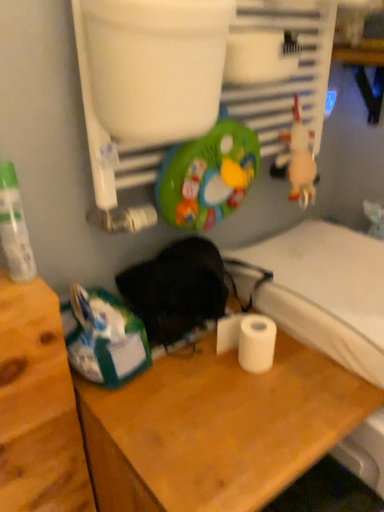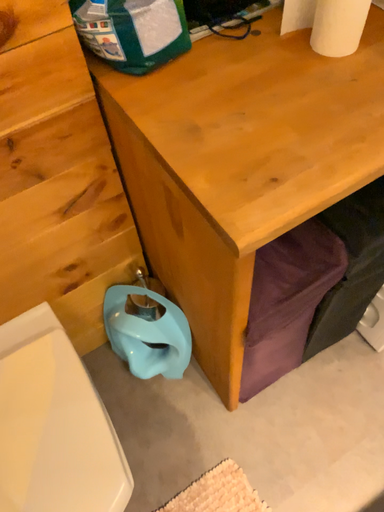
Question: Which way did the camera rotate in the video?

Choices:
 (A) rotated upward
 (B) rotated downward

Answer: (B)